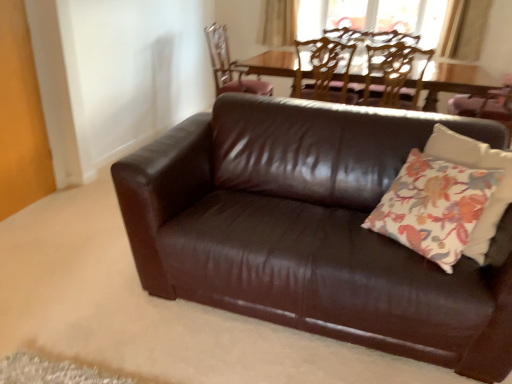
Question: Is wooden chair at upper center, the 3th chair from the right, smaller than wooden textured chair at upper center, the 3th chair viewed from the left?

Choices:
 (A) no
 (B) yes

Answer: (A)

Question: Is wooden chair at upper center, the 3th chair from the right, shorter than wooden textured chair at upper center, the 3th chair viewed from the left?

Choices:
 (A) no
 (B) yes

Answer: (A)

Question: From a real-world perspective, is wooden chair at upper center, positioned as the 1th chair in left-to-right order, located higher than wooden textured chair at upper center, the 1th chair when ordered from right to left?

Choices:
 (A) no
 (B) yes

Answer: (A)

Question: Does wooden chair at upper center, the 3th chair from the right, appear on the right side of wooden textured chair at upper center, the 3th chair viewed from the left?

Choices:
 (A) no
 (B) yes

Answer: (A)

Question: Is wooden chair at upper center, positioned as the 1th chair in left-to-right order, positioned beyond the bounds of wooden textured chair at upper center, the 3th chair viewed from the left?

Choices:
 (A) yes
 (B) no

Answer: (A)

Question: Considering the positions of point (404, 49) and point (473, 226), is point (404, 49) closer or farther from the camera than point (473, 226)?

Choices:
 (A) closer
 (B) farther

Answer: (B)

Question: Choose the correct answer: Is wooden textured chair at upper center, the 3th chair viewed from the left, inside floral fabric pillow at center or outside it?

Choices:
 (A) inside
 (B) outside

Answer: (B)

Question: From the image's perspective, is wooden textured chair at upper center, the 3th chair viewed from the left, located above or below floral fabric pillow at center?

Choices:
 (A) below
 (B) above

Answer: (B)

Question: In terms of size, does wooden textured chair at upper center, the 3th chair viewed from the left, appear bigger or smaller than floral fabric pillow at center?

Choices:
 (A) small
 (B) big

Answer: (B)

Question: From their relative heights in the image, would you say floral fabric pillow at center is taller or shorter than brown leather couch at center?

Choices:
 (A) short
 (B) tall

Answer: (A)

Question: Is point (454, 243) closer or farther from the camera than point (343, 327)?

Choices:
 (A) closer
 (B) farther

Answer: (A)

Question: From the image's perspective, is floral fabric pillow at center positioned above or below brown leather couch at center?

Choices:
 (A) above
 (B) below

Answer: (A)

Question: From a real-world perspective, is floral fabric pillow at center positioned above or below brown leather couch at center?

Choices:
 (A) below
 (B) above

Answer: (B)

Question: Which is correct: beige fabric curtain at upper center is inside wooden textured chair at upper center, the 1th chair when ordered from right to left, or outside of it?

Choices:
 (A) inside
 (B) outside

Answer: (B)

Question: Is beige fabric curtain at upper center bigger or smaller than wooden textured chair at upper center, the 3th chair viewed from the left?

Choices:
 (A) small
 (B) big

Answer: (A)